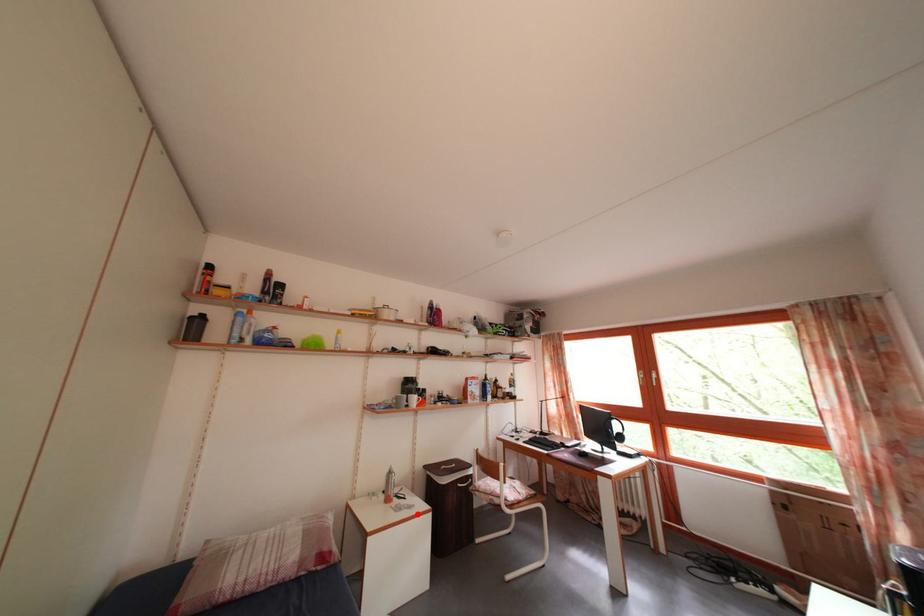
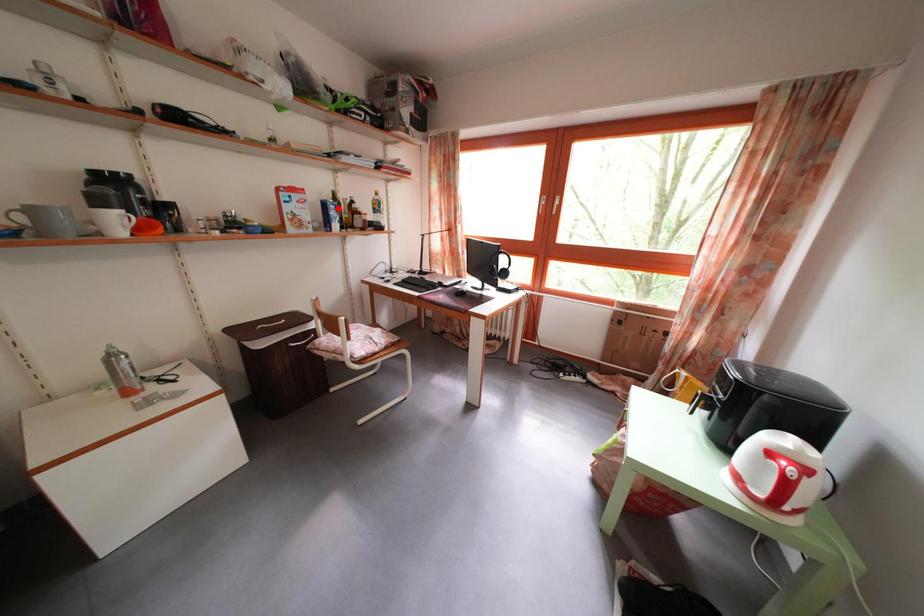
I am providing you with two images of the same scene from different viewpoints. A red point is marked on the first image and another point is marked on the second image. Does the point marked in image1 correspond to the same location as the one in image2?

No